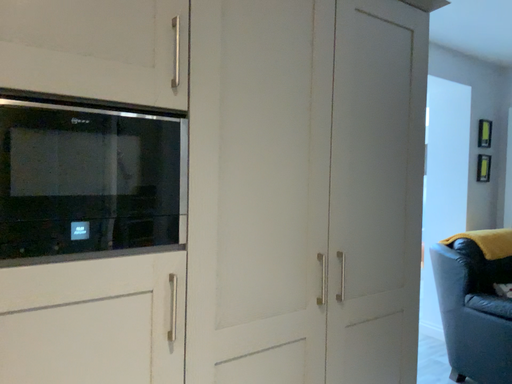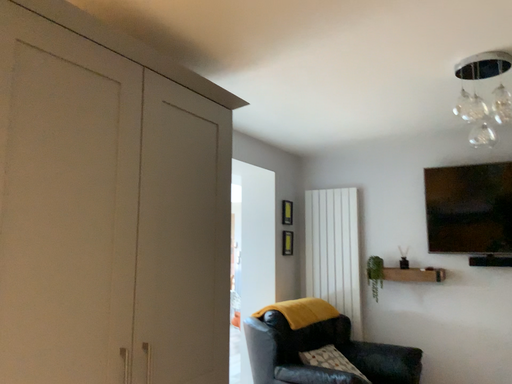
Question: Which way did the camera rotate in the video?

Choices:
 (A) rotated right
 (B) rotated left

Answer: (A)